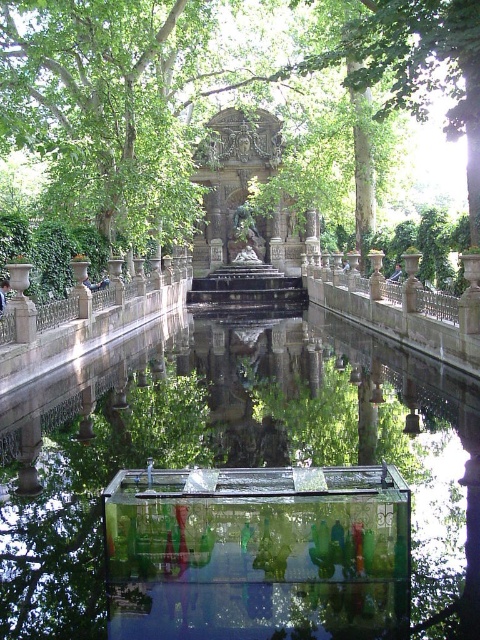
Question: Does transparent glass water at center have a smaller size compared to green leafy tree at center?

Choices:
 (A) yes
 (B) no

Answer: (A)

Question: Which object appears closest to the camera in this image?

Choices:
 (A) transparent glass water at center
 (B) green leafy tree at center

Answer: (A)

Question: Can you confirm if transparent glass water at center is bigger than green leafy tree at center?

Choices:
 (A) no
 (B) yes

Answer: (A)

Question: Which point is farther to the camera?

Choices:
 (A) transparent glass water at center
 (B) green leafy tree at center

Answer: (B)

Question: From the image, what is the correct spatial relationship of transparent glass water at center in relation to green leafy tree at center?

Choices:
 (A) right
 (B) left

Answer: (B)